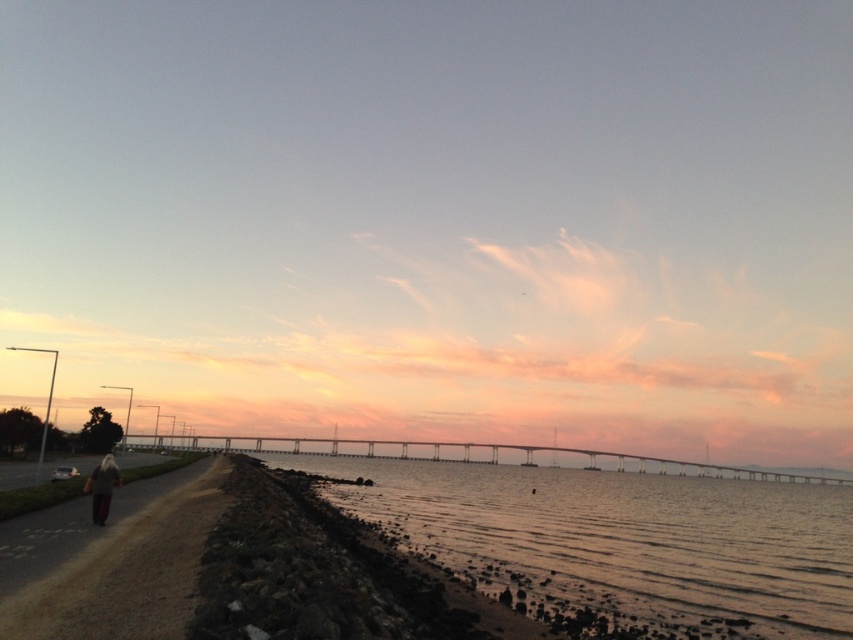
You are standing on the sandy beach at lower center and want to walk to the dark gray fabric jacket at lower left. Is the path wide enough for you to walk directly to the jacket without stepping onto the sand?

The sandy beach at lower center might be wider than dark gray fabric jacket at lower left, but since the jacket is an object and not a path, the width comparison doesn